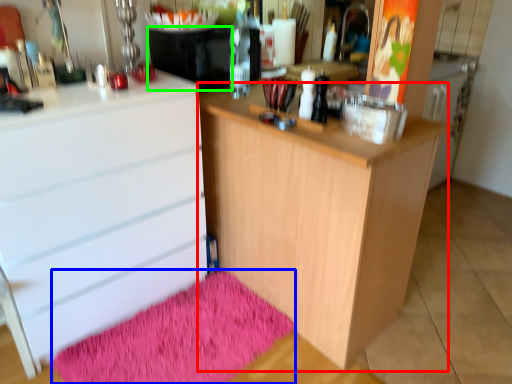
Question: Which is nearer to the cupboard (highlighted by a red box)? bath mat (highlighted by a blue box) or appliance (highlighted by a green box).

Choices:
 (A) bath mat
 (B) appliance

Answer: (A)